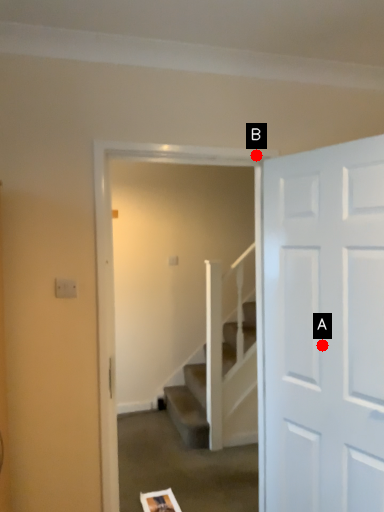
Question: Two points are circled on the image, labeled by A and B beside each circle. Which of the following is the closest to the observer?

Choices:
 (A) A is closer
 (B) B is closer

Answer: (A)